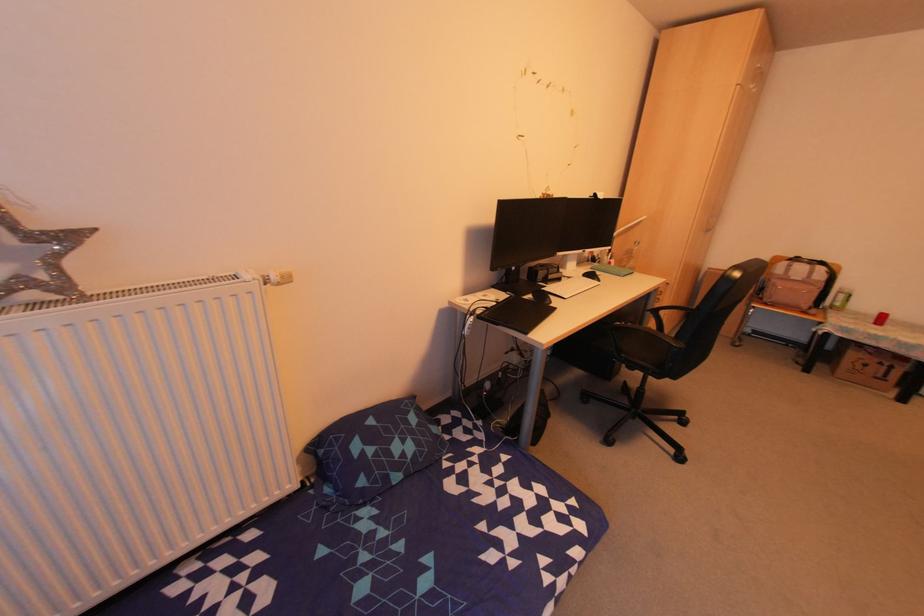
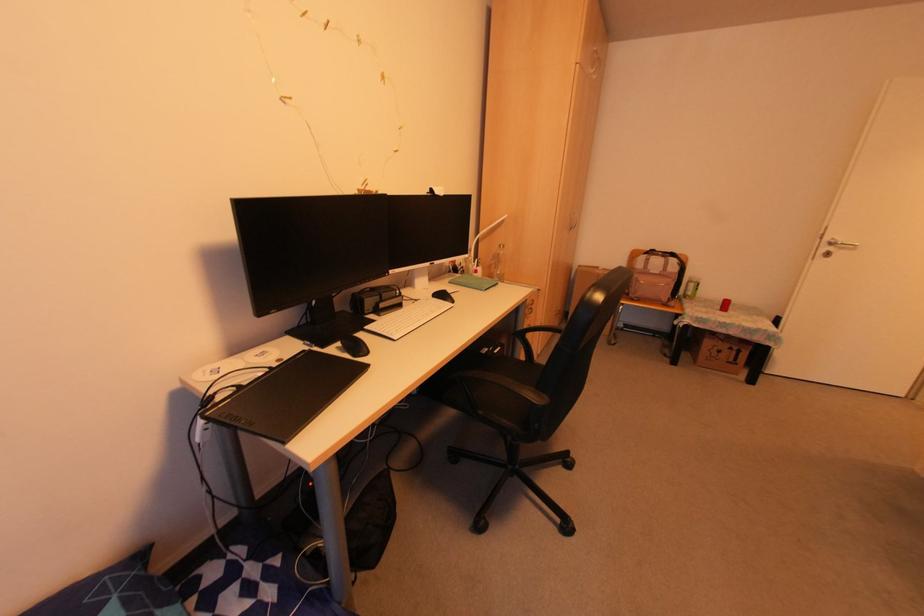
Find the pixel in the second image that matches the point at 704,232 in the first image.

(568, 229)